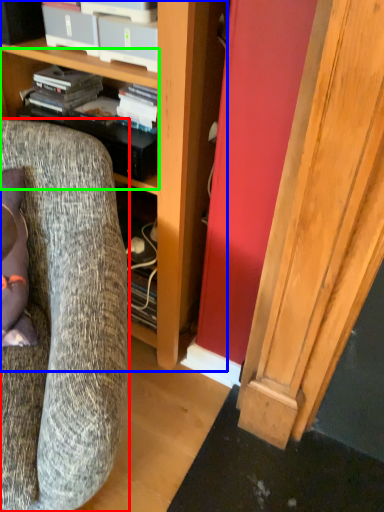
Question: Which is farther away from chair (highlighted by a red box)? cabinetry (highlighted by a blue box) or shelf (highlighted by a green box)?

Choices:
 (A) cabinetry
 (B) shelf

Answer: (B)